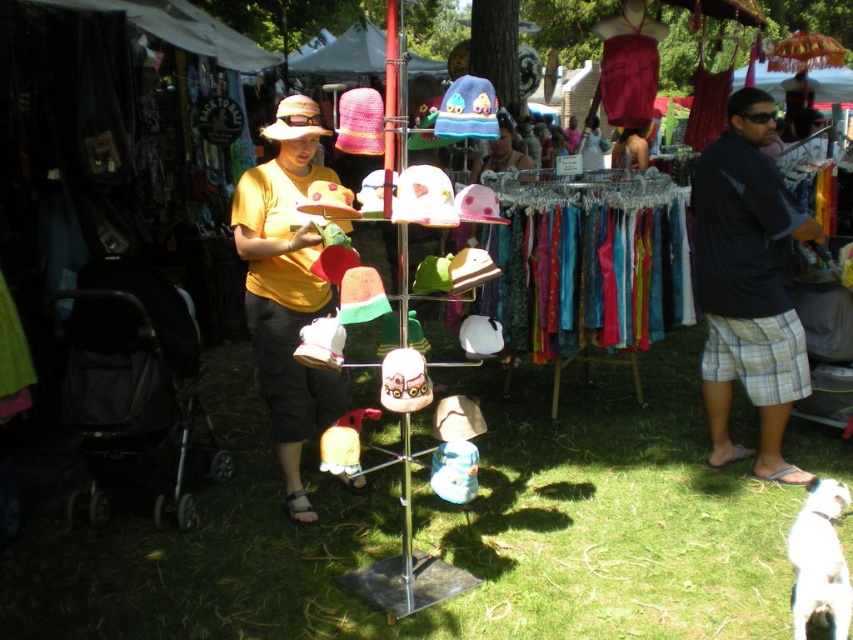
You are a customer at the market who wants to buy a matte pink hat at center. However, you notice a white fur dog at lower right nearby. Can you tell me the relative size between the two?

The white fur dog at lower right is larger in size than matte pink hat at center.

You are a customer at the market looking for a shirt to buy. You see the dark blue shirt at right and the yellow matte shirt at center. Which shirt is located to the right of the other?

The dark blue shirt at right is positioned on the right side of the yellow matte shirt at center.